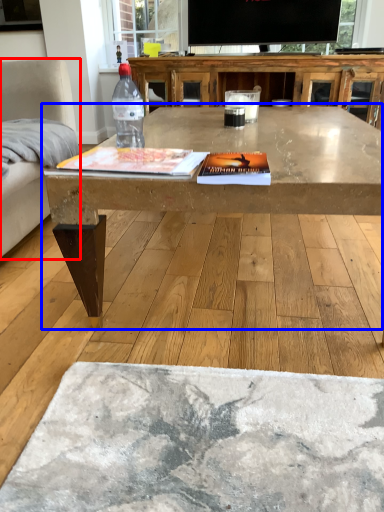
Question: Which point is further to the camera, armchair (highlighted by a red box) or coffee table (highlighted by a blue box)?

Choices:
 (A) armchair
 (B) coffee table

Answer: (A)